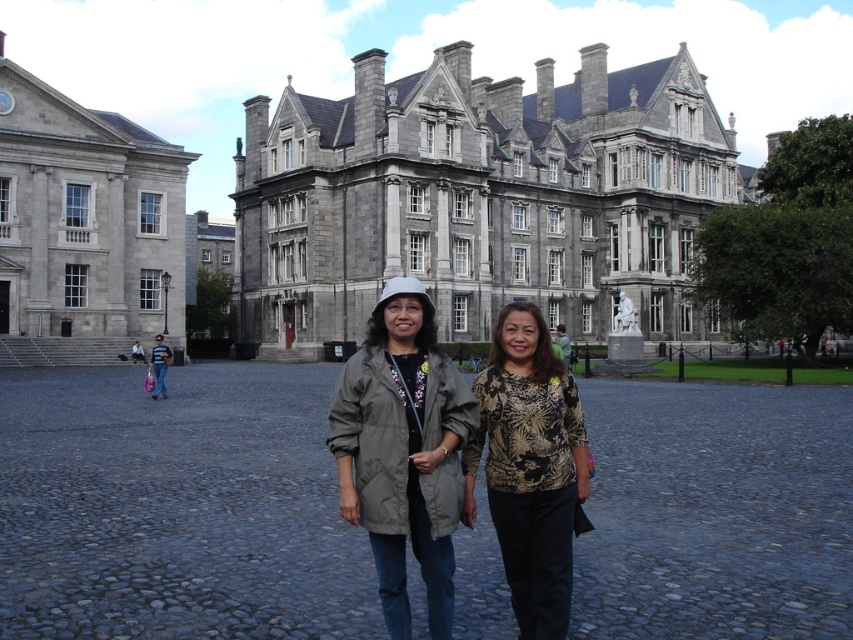
Question: Is gray stone building at left to the left of matte gray coat at center from the viewer's perspective?

Choices:
 (A) yes
 (B) no

Answer: (A)

Question: Is gray stone building at center below matte gray coat at center?

Choices:
 (A) yes
 (B) no

Answer: (B)

Question: Based on their relative distances, which object is farther from the gray stone building at left?

Choices:
 (A) gray stone building at center
 (B) printed fabric blouse at center
 (C) matte gray coat at center

Answer: (B)

Question: Among these objects, which one is nearest to the camera?

Choices:
 (A) printed fabric blouse at center
 (B) matte gray coat at center

Answer: (A)

Question: From the image, what is the correct spatial relationship of gray stone building at left in relation to matte gray coat at center?

Choices:
 (A) left
 (B) right

Answer: (A)

Question: Which point appears farthest from the camera in this image?

Choices:
 (A) (656, 337)
 (B) (47, 276)
 (C) (431, 429)
 (D) (497, 497)

Answer: (A)